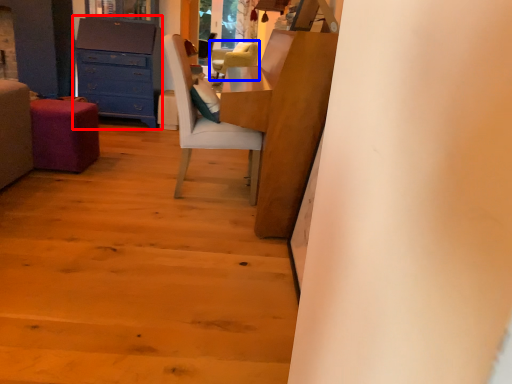
Question: Among these objects, which one is farthest to the camera, chest of drawers (highlighted by a red box) or chair (highlighted by a blue box)?

Choices:
 (A) chest of drawers
 (B) chair

Answer: (B)